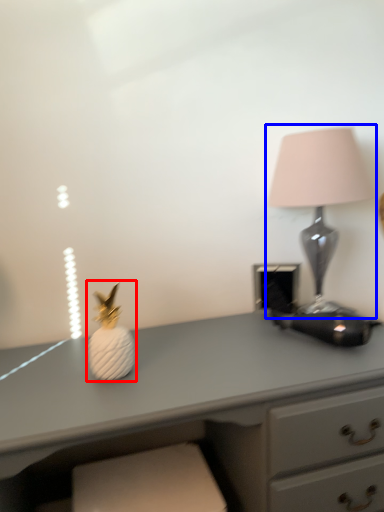
Question: Which of the following is the closest to the observer, miniature (highlighted by a red box) or lamp (highlighted by a blue box)?

Choices:
 (A) miniature
 (B) lamp

Answer: (A)